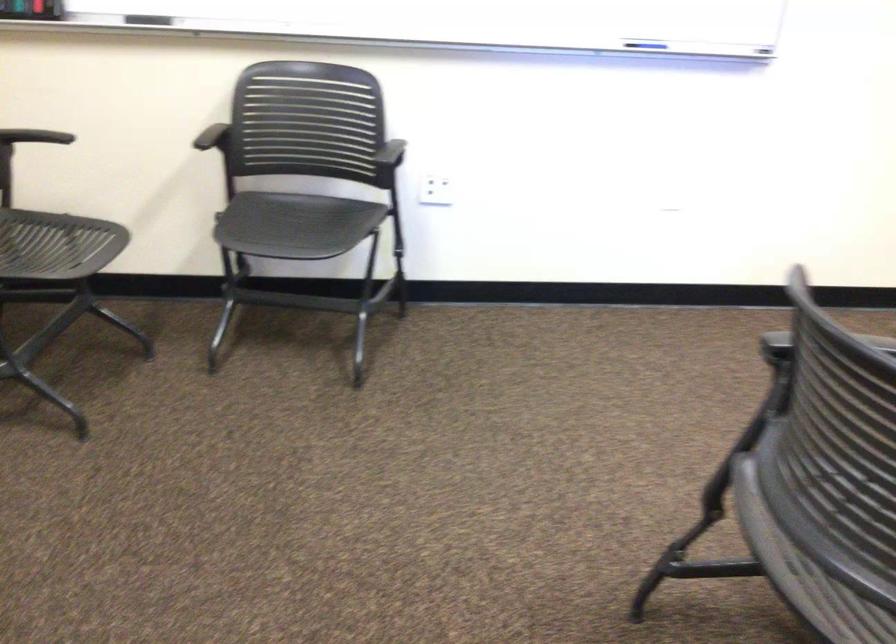
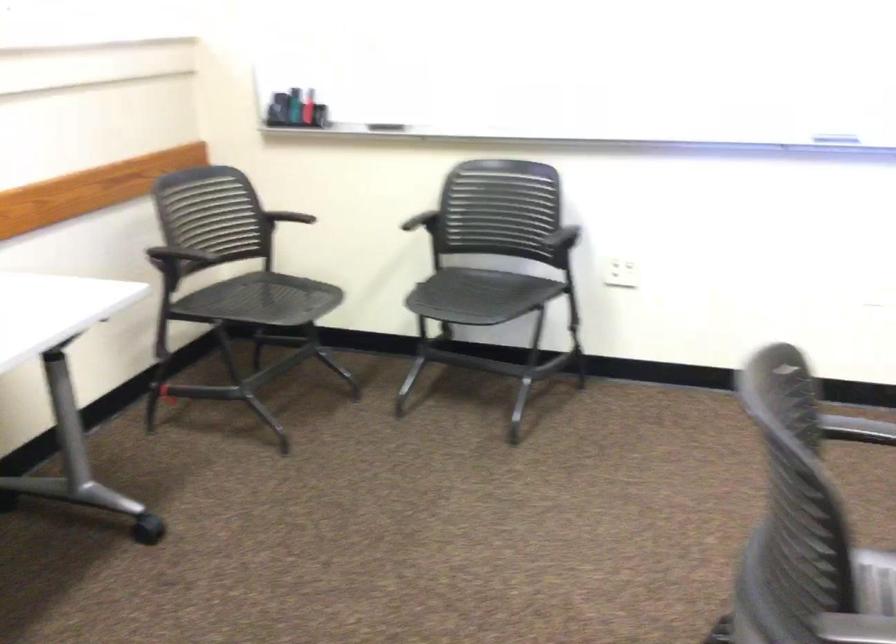
The point at (35, 136) is marked in the first image. Where is the corresponding point in the second image?

(283, 219)